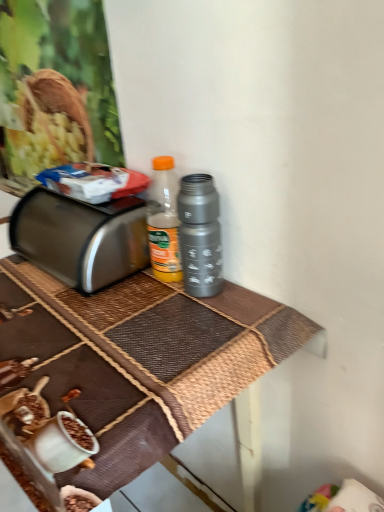
Question: Is satin silver toaster at left smaller than metallic gray thermos at center?

Choices:
 (A) yes
 (B) no

Answer: (B)

Question: Can you confirm if satin silver toaster at left is positioned to the left of metallic gray thermos at center?

Choices:
 (A) no
 (B) yes

Answer: (B)

Question: From the image's perspective, is satin silver toaster at left located beneath metallic gray thermos at center?

Choices:
 (A) yes
 (B) no

Answer: (B)

Question: Considering the relative positions of satin silver toaster at left and metallic gray thermos at center in the image provided, is satin silver toaster at left in front of metallic gray thermos at center?

Choices:
 (A) yes
 (B) no

Answer: (B)

Question: Does satin silver toaster at left have a greater height compared to metallic gray thermos at center?

Choices:
 (A) no
 (B) yes

Answer: (A)

Question: Would you say metallic gray thermos at center is inside or outside satin silver toaster at left?

Choices:
 (A) outside
 (B) inside

Answer: (A)

Question: Is metallic gray thermos at center bigger or smaller than satin silver toaster at left?

Choices:
 (A) small
 (B) big

Answer: (A)

Question: In the image, is metallic gray thermos at center positioned in front of or behind satin silver toaster at left?

Choices:
 (A) behind
 (B) front

Answer: (B)

Question: Considering the positions of point (178, 211) and point (105, 246), is point (178, 211) closer or farther from the camera than point (105, 246)?

Choices:
 (A) closer
 (B) farther

Answer: (A)

Question: Considering the positions of metallic gray thermos at center and metallic brown table at center in the image, is metallic gray thermos at center wider or thinner than metallic brown table at center?

Choices:
 (A) thin
 (B) wide

Answer: (A)

Question: From the image's perspective, is metallic gray thermos at center above or below metallic brown table at center?

Choices:
 (A) below
 (B) above

Answer: (B)

Question: Is metallic gray thermos at center to the left or to the right of metallic brown table at center in the image?

Choices:
 (A) right
 (B) left

Answer: (A)

Question: In terms of height, does metallic gray thermos at center look taller or shorter compared to metallic brown table at center?

Choices:
 (A) short
 (B) tall

Answer: (A)

Question: Visually, is satin silver toaster at left positioned to the left or to the right of metallic gray thermos at center?

Choices:
 (A) left
 (B) right

Answer: (A)

Question: From a real-world perspective, is satin silver toaster at left physically located above or below metallic gray thermos at center?

Choices:
 (A) above
 (B) below

Answer: (B)